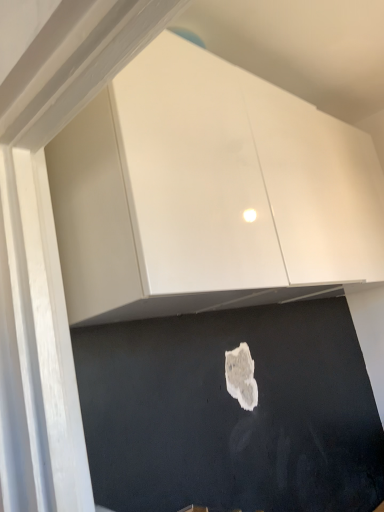
What do you see at coordinates (208, 193) in the screenshot?
I see `white glossy cabinet at upper center` at bounding box center [208, 193].

Where is `white glossy cabinet at upper center`? The width and height of the screenshot is (384, 512). white glossy cabinet at upper center is located at coordinates (208, 193).

Identify the location of white glossy cabinet at upper center. This screenshot has width=384, height=512. (208, 193).